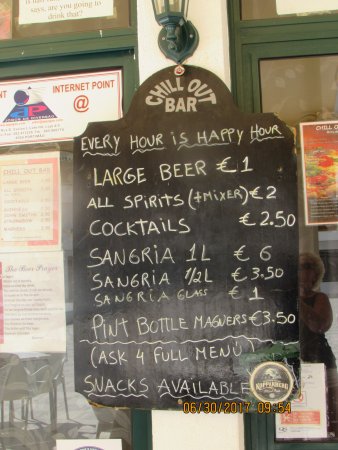
Identify the location of reflection of chairs. The width and height of the screenshot is (338, 450). (38, 376).